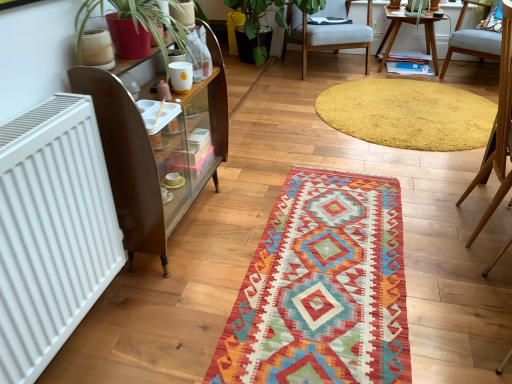
Find the location of a particular element. vacant location below yellow shaggy rug at upper center, which appears as the 1th mat when viewed from the top (from a real-world perspective) is located at coordinates (404, 107).